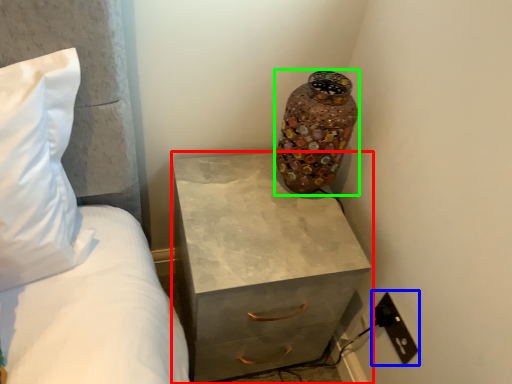
Question: Which object is positioned farthest from chest of drawers (highlighted by a red box)? Select from electric outlet (highlighted by a blue box) and vase (highlighted by a green box).

Choices:
 (A) electric outlet
 (B) vase

Answer: (A)